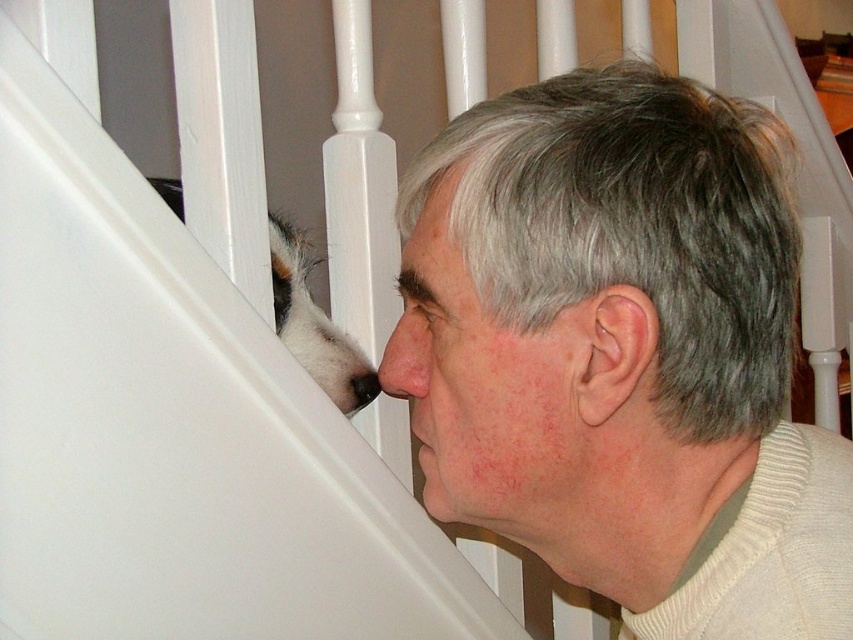
In the scene shown: You are a photographer capturing this moment between the man and his dog. You notice the white ribbed sweater at lower right and the matte white nose at center. Based on their positions, which object would appear larger in your photo?

The white ribbed sweater at lower right appears larger in the photo because it is taller than the matte white nose at center.

You are a photographer trying to capture the perfect shot of the man and his dog. You notice two points in the scene marked as point 1 at coordinates point (x=757, y=224) and point 2 at coordinates point (x=399, y=372). Which point is positioned closer to the camera, and why?

Point 1 at coordinates point (x=757, y=224) is closer to the camera than point 2 at coordinates point (x=399, y=372) because the description states that point (x=757, y=224) is closer to the camera than point (x=399, y=372).

You are a photographer capturing this moment between the man and the dog. You notice the white matte hair at upper center and the matte white nose at center. Which object is positioned to the right side of the other?

The white matte hair at upper center is positioned to the right of the matte white nose at center.